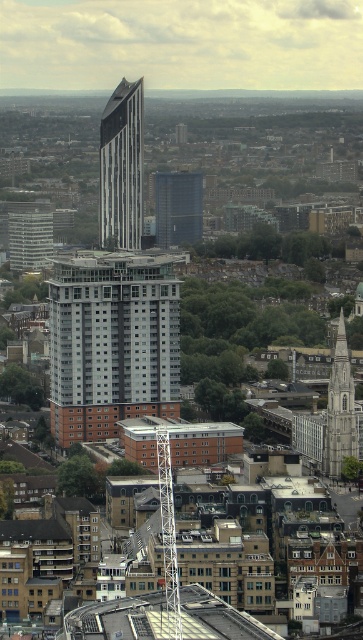
Is white concrete building at center positioned behind white metal spire at center?

That is True.

Is white concrete building at center closer to camera compared to white metal spire at center?

No, it is behind white metal spire at center.

Where is `white concrete building at center`? white concrete building at center is located at coordinates (112, 342).

Where is `white concrete building at center`? This screenshot has height=640, width=363. white concrete building at center is located at coordinates (112, 342).

Consider the image. Is stone tower at center in front of dark blue glass building at center?

That is True.

Does stone tower at center have a greater height compared to dark blue glass building at center?

Correct, stone tower at center is much taller as dark blue glass building at center.

You are a GUI agent. You are given a task and a screenshot of the screen. Output one action in this format:
    pyautogui.click(x=<x>, y=<y>)
    Task: Click on the stone tower at center
    The height and width of the screenshot is (640, 363).
    Given the screenshot: What is the action you would take?
    pyautogui.click(x=340, y=408)

Measure the distance from stone tower at center to white metal spire at center.

stone tower at center is 72.59 meters from white metal spire at center.

Does stone tower at center come behind white metal spire at center?

Yes, it is.

Between point (341, 436) and point (169, 486), which one is positioned behind?

The point (341, 436) is behind.

The image size is (363, 640). I want to click on stone tower at center, so click(340, 408).